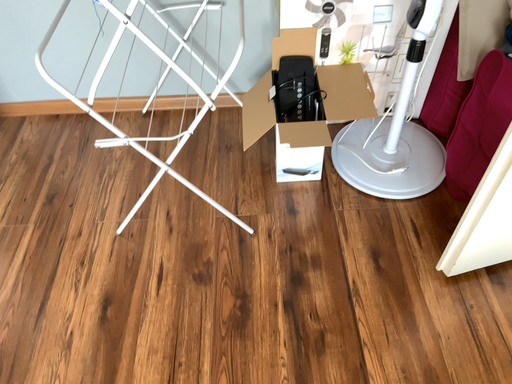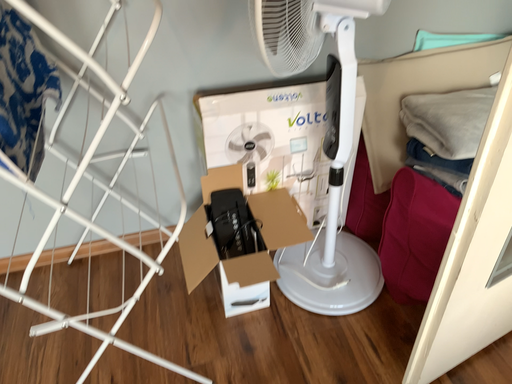
Question: Which way did the camera rotate in the video?

Choices:
 (A) rotated downward
 (B) rotated upward

Answer: (B)